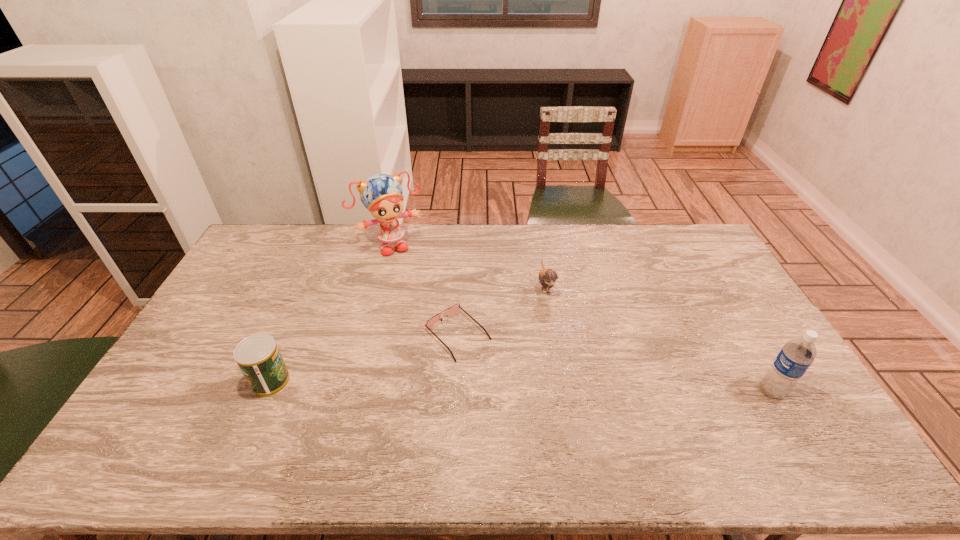
This screenshot has width=960, height=540. Identify the location of the third shortest object. (x=258, y=357).

Where is `can`? can is located at coordinates (258, 357).

Locate an element on the screen. This screenshot has height=540, width=960. water bottle is located at coordinates (796, 356).

The height and width of the screenshot is (540, 960). In order to click on the rightmost object in this screenshot , I will do `click(796, 356)`.

Find the location of a particular element. The width and height of the screenshot is (960, 540). doll is located at coordinates (381, 194).

Identify the location of the farthest object. The width and height of the screenshot is (960, 540). (381, 194).

At what (x,y) coordinates should I click in order to perform the action: click on the shortest object. Please return your answer as a coordinate pair (x, y). The image size is (960, 540). Looking at the image, I should click on (452, 310).

The width and height of the screenshot is (960, 540). Find the location of `the third nearest object`. the third nearest object is located at coordinates (452, 310).

The width and height of the screenshot is (960, 540). What are the coordinates of `the second shortest object` in the screenshot? It's located at (547, 278).

Find the location of `kitten`. kitten is located at coordinates (547, 278).